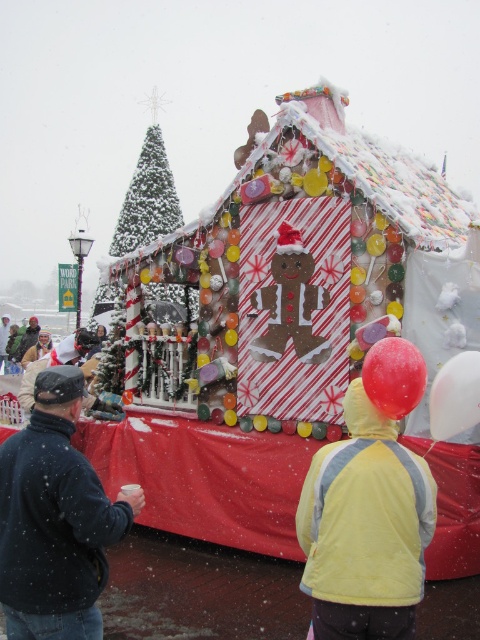
Can you confirm if black fleece jacket at lower left is positioned below yellow fleece jacket at center?

Indeed, black fleece jacket at lower left is positioned under yellow fleece jacket at center.

The width and height of the screenshot is (480, 640). What do you see at coordinates (55, 518) in the screenshot?
I see `black fleece jacket at lower left` at bounding box center [55, 518].

Does point (12, 531) come farther from viewer compared to point (320, 472)?

No, it is in front of (320, 472).

What are the coordinates of `black fleece jacket at lower left` in the screenshot? It's located at click(55, 518).